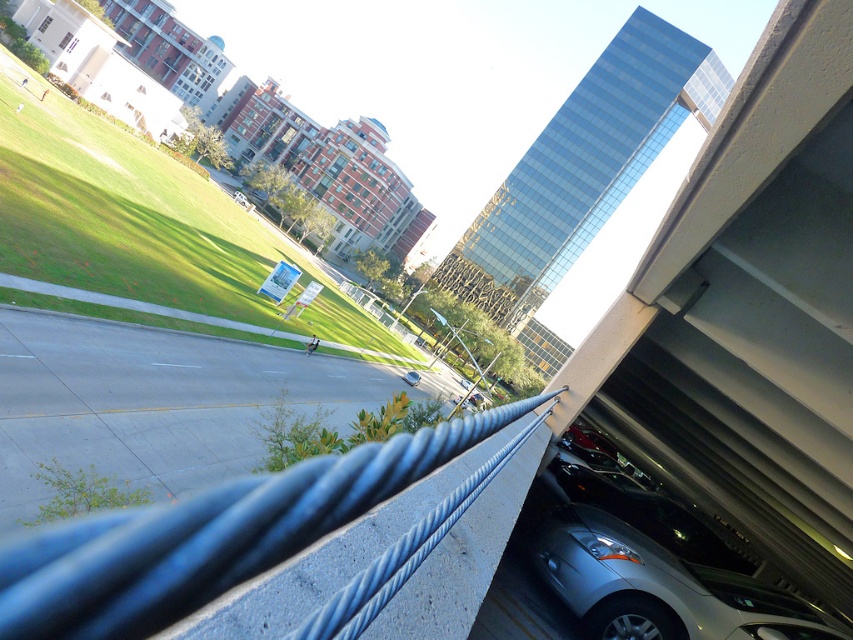
Question: Is blue rubber highway at lower left wider than satin silver car at lower right?

Choices:
 (A) yes
 (B) no

Answer: (A)

Question: Which object is the farthest from the blue rubber highway at lower left?

Choices:
 (A) blue metallic rail at center
 (B) satin silver car at lower right

Answer: (B)

Question: Does blue metallic rail at center have a larger size compared to satin silver car at lower right?

Choices:
 (A) yes
 (B) no

Answer: (A)

Question: Can you confirm if blue rubber highway at lower left is positioned to the left of satin silver car at lower right?

Choices:
 (A) no
 (B) yes

Answer: (B)

Question: Which point is farther to the camera?

Choices:
 (A) blue metallic rail at center
 (B) satin silver car at lower right
 (C) blue rubber highway at lower left

Answer: (C)

Question: Which point is closer to the camera?

Choices:
 (A) satin silver car at lower right
 (B) blue rubber highway at lower left

Answer: (A)